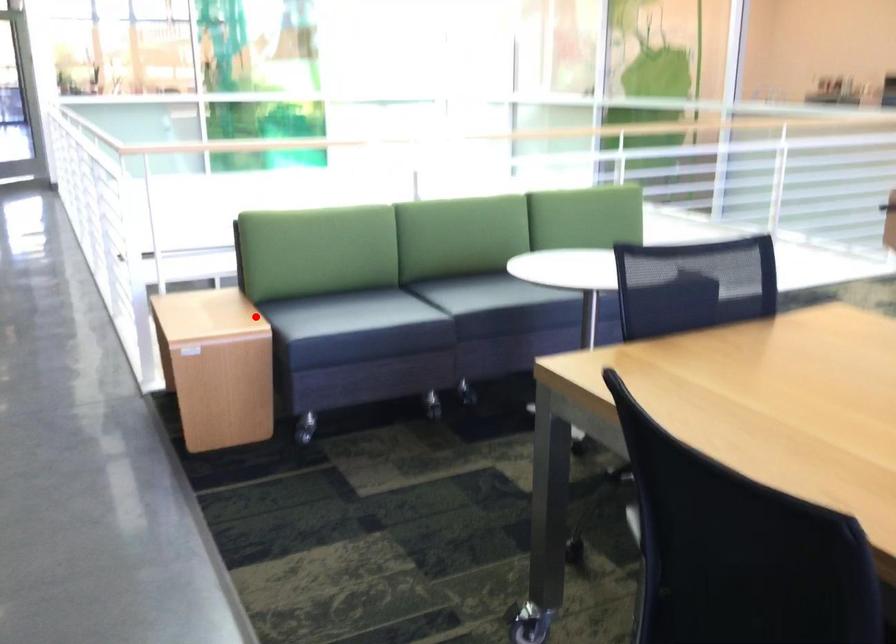
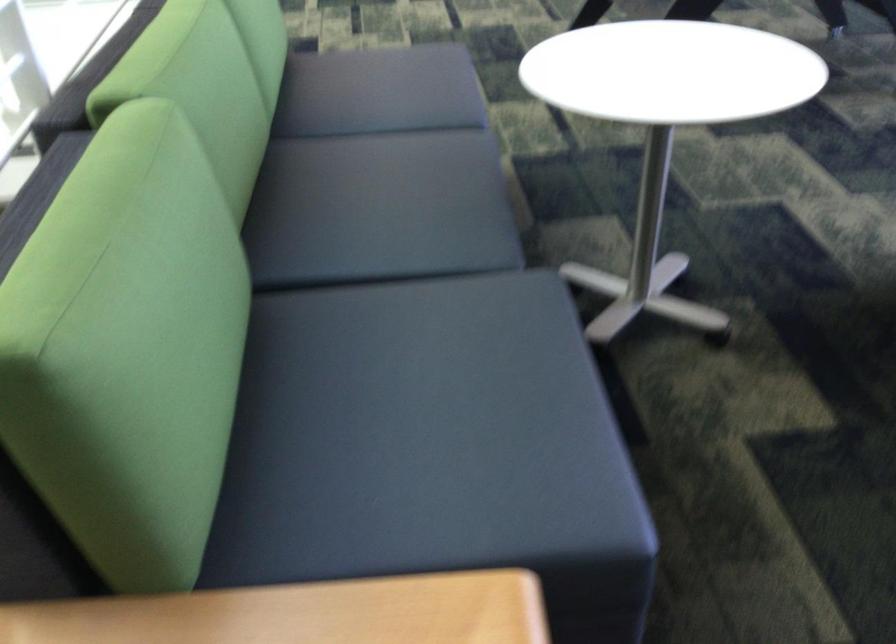
Question: I am providing you with two images of the same scene from different viewpoints. In image1, a red point is highlighted. Considering the same 3D point in image2, which of the following is correct?

Choices:
 (A) It is closer
 (B) It is farther

Answer: (A)